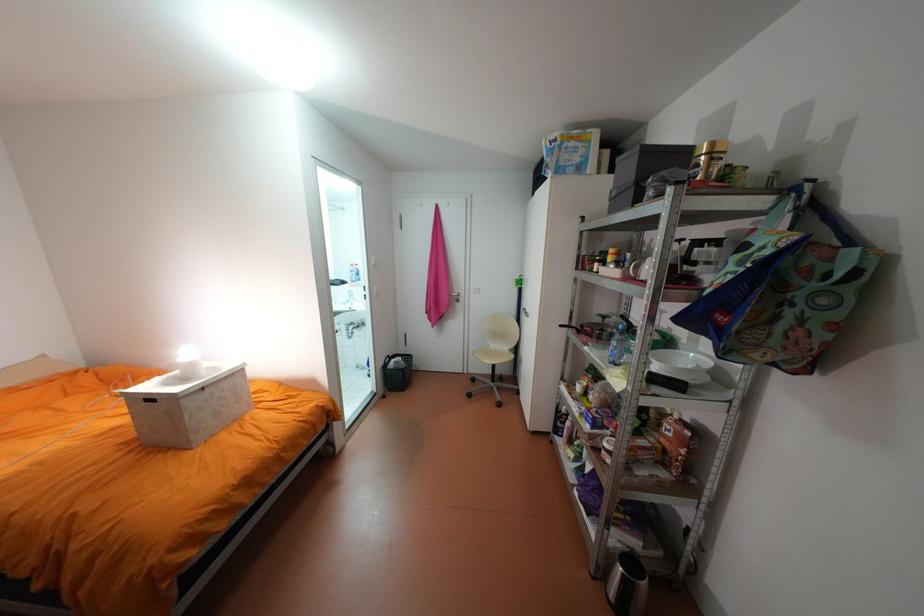
Where is `black mesh basket`? black mesh basket is located at coordinates (396, 371).